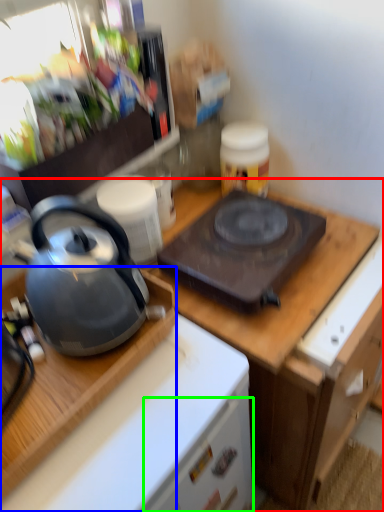
Question: Which is farther away from cabinetry (highlighted by a red box)? desk (highlighted by a blue box) or drawer (highlighted by a green box)?

Choices:
 (A) desk
 (B) drawer

Answer: (A)